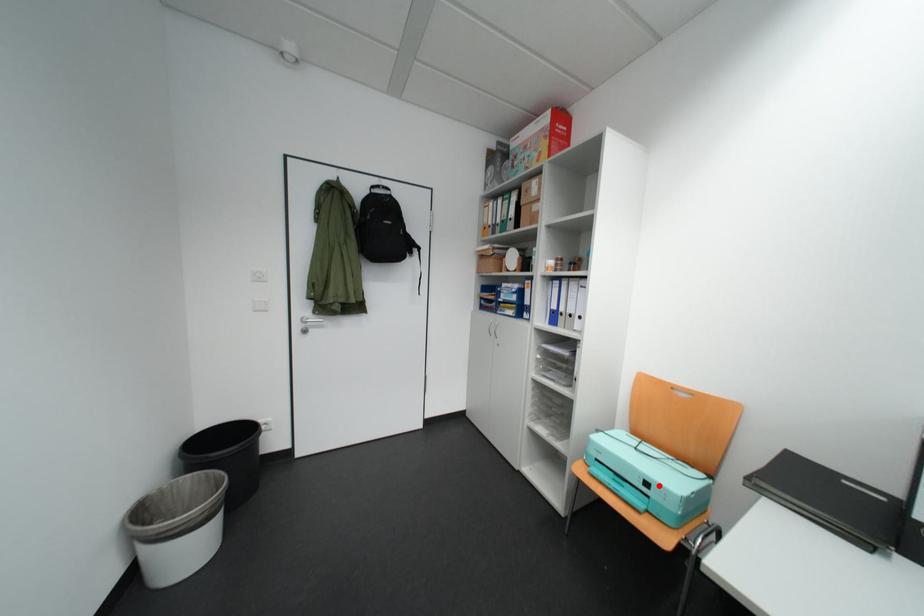
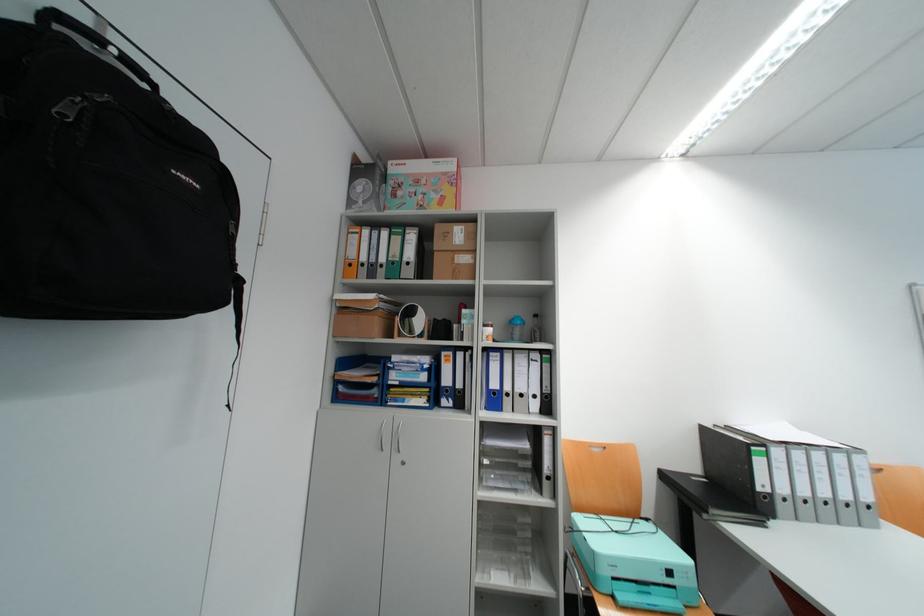
The point at the highlighted location is marked in the first image. Where is the corresponding point in the second image?

(682, 573)